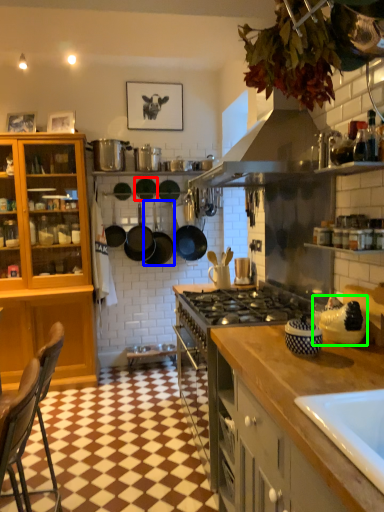
Question: Which object is the closest to the frying pan (highlighted by a red box)? Choose among these: kitchen appliance (highlighted by a blue box) or appliance (highlighted by a green box).

Choices:
 (A) kitchen appliance
 (B) appliance

Answer: (A)